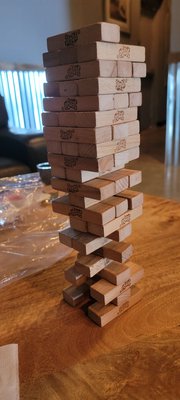
You are a GUI agent. You are given a task and a screenshot of the screen. Output one action in this format:
    pyautogui.click(x=<x>, y=<y>)
    Task: Click on the jenga game
    The width and height of the screenshot is (180, 400).
    Given the screenshot: What is the action you would take?
    pyautogui.click(x=109, y=221), pyautogui.click(x=113, y=148), pyautogui.click(x=107, y=64)